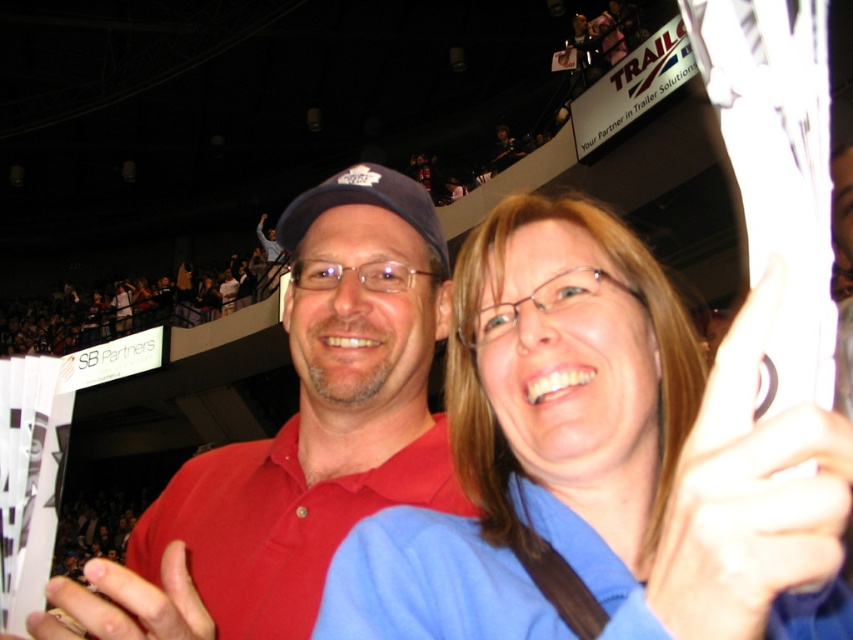
You are standing in the indoor arena and want to locate the blue fabric shirt at center. According to the coordinates provided, where should you look?

You should look at point (602, 460) to find the blue fabric shirt at center.

You are organizing a photo shoot and need to arrange two shirts for a photoshoot setup. The blue fabric shirt at center and the matte red shirt at center are placed on a table. Given their sizes, which shirt would require more space on the table?

The matte red shirt at center requires more space on the table because it has a larger size compared to the blue fabric shirt at center.